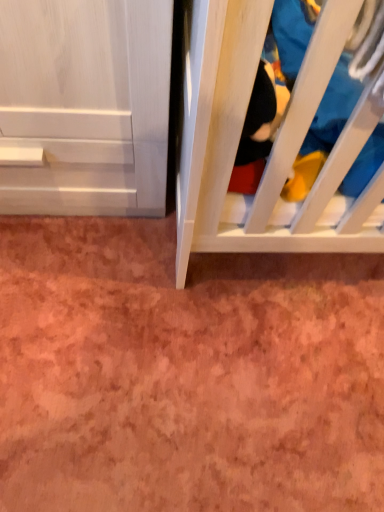
Question: Based on their positions, is wooden crib at right located to the left or right of blue cotton shirt at right?

Choices:
 (A) left
 (B) right

Answer: (A)

Question: Relative to blue cotton shirt at right, is wooden crib at right in front or behind?

Choices:
 (A) front
 (B) behind

Answer: (A)

Question: From the image's perspective, is wooden crib at right above or below blue cotton shirt at right?

Choices:
 (A) above
 (B) below

Answer: (B)

Question: Considering the positions of blue cotton shirt at right and wooden crib at right in the image, is blue cotton shirt at right bigger or smaller than wooden crib at right?

Choices:
 (A) small
 (B) big

Answer: (B)

Question: Considering the positions of blue cotton shirt at right and wooden crib at right in the image, is blue cotton shirt at right taller or shorter than wooden crib at right?

Choices:
 (A) short
 (B) tall

Answer: (A)

Question: Considering the positions of blue cotton shirt at right and wooden crib at right in the image, is blue cotton shirt at right wider or thinner than wooden crib at right?

Choices:
 (A) thin
 (B) wide

Answer: (B)

Question: Is blue cotton shirt at right to the left or to the right of wooden crib at right in the image?

Choices:
 (A) left
 (B) right

Answer: (B)